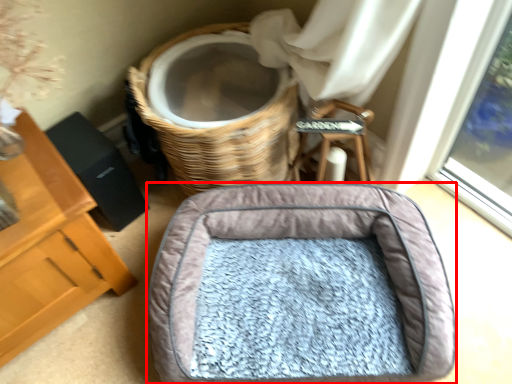
Question: From the image's perspective, what is the correct spatial relationship of dog bed (annotated by the red box) in relation to basket?

Choices:
 (A) above
 (B) below

Answer: (B)